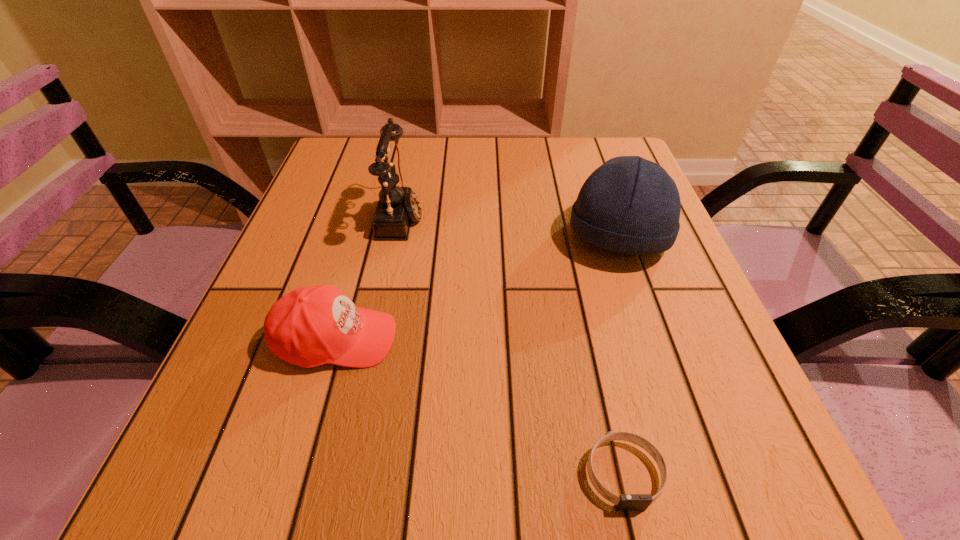
Where is `the third closest object to the tallest object`? the third closest object to the tallest object is located at coordinates (625, 502).

This screenshot has height=540, width=960. I want to click on vacant space that satisfies the following two spatial constraints: 1. on the dial of the tallest object; 2. on the left side of the third shortest object, so click(397, 237).

Identify the location of free space that satisfies the following two spatial constraints: 1. on the front side of the second tallest object; 2. on the front panel of the baseball cap. The image size is (960, 540). (654, 339).

The width and height of the screenshot is (960, 540). In order to click on vacant region that satisfies the following two spatial constraints: 1. on the back side of the second tallest object; 2. on the dial of the telephone in this screenshot , I will do `click(611, 215)`.

Identify the location of free space that satisfies the following two spatial constraints: 1. on the dial of the tallest object; 2. on the left side of the skullcap. This screenshot has width=960, height=540. (397, 237).